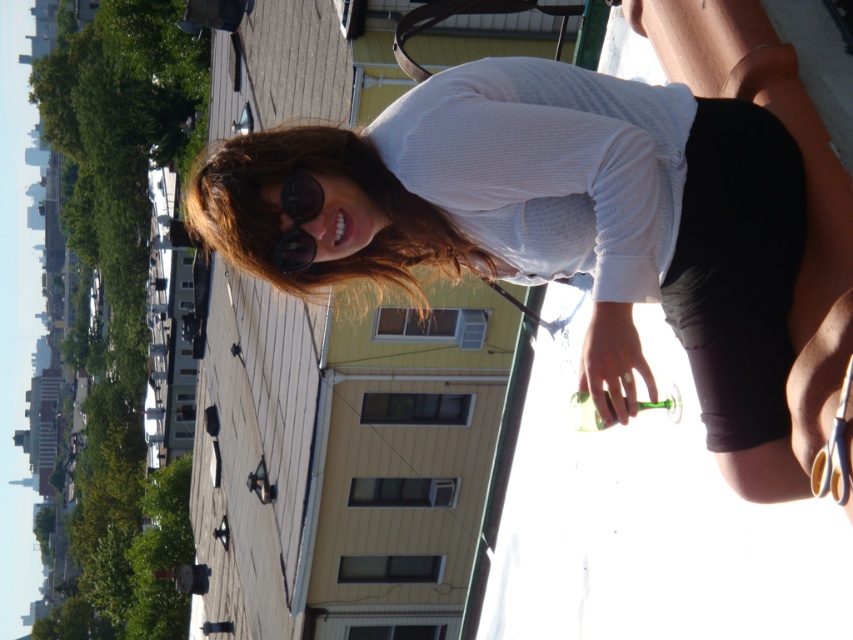
Does white textured shirt at upper center lie in front of transparent dark blue sunglasses at upper center?

That is True.

Who is shorter, white textured shirt at upper center or transparent dark blue sunglasses at upper center?

Standing shorter between the two is transparent dark blue sunglasses at upper center.

Between point (276, 232) and point (291, 212), which one is positioned in front?

Positioned in front is point (291, 212).

Find the location of a particular element. This screenshot has width=853, height=640. white textured shirt at upper center is located at coordinates (569, 228).